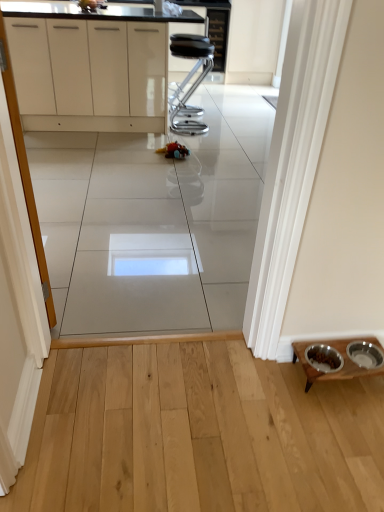
Question: Does plush multicolored toy at center appear on the left side of white glossy cabinets at upper center?

Choices:
 (A) yes
 (B) no

Answer: (B)

Question: Is the surface of plush multicolored toy at center in direct contact with white glossy cabinets at upper center?

Choices:
 (A) yes
 (B) no

Answer: (B)

Question: Is plush multicolored toy at center taller than white glossy cabinets at upper center?

Choices:
 (A) no
 (B) yes

Answer: (A)

Question: Is plush multicolored toy at center positioned with its back to white glossy cabinets at upper center?

Choices:
 (A) no
 (B) yes

Answer: (B)

Question: Considering the relative sizes of plush multicolored toy at center and white glossy cabinets at upper center in the image provided, is plush multicolored toy at center wider than white glossy cabinets at upper center?

Choices:
 (A) no
 (B) yes

Answer: (A)

Question: Can you confirm if plush multicolored toy at center is bigger than white glossy cabinets at upper center?

Choices:
 (A) yes
 (B) no

Answer: (B)

Question: Can you confirm if wooden table at lower right is shorter than white glossy cabinet at left?

Choices:
 (A) yes
 (B) no

Answer: (A)

Question: Does wooden table at lower right touch white glossy cabinet at left?

Choices:
 (A) yes
 (B) no

Answer: (B)

Question: Is white glossy cabinet at left surrounded by wooden table at lower right?

Choices:
 (A) yes
 (B) no

Answer: (B)

Question: Is wooden table at lower right positioned in front of white glossy cabinet at left?

Choices:
 (A) no
 (B) yes

Answer: (A)

Question: From a real-world perspective, is wooden table at lower right under white glossy cabinet at left?

Choices:
 (A) yes
 (B) no

Answer: (A)

Question: From the image's perspective, is wooden table at lower right under white glossy cabinet at left?

Choices:
 (A) no
 (B) yes

Answer: (B)

Question: Is white glossy cabinets at upper center to the right of black leather stool at center from the viewer's perspective?

Choices:
 (A) yes
 (B) no

Answer: (B)